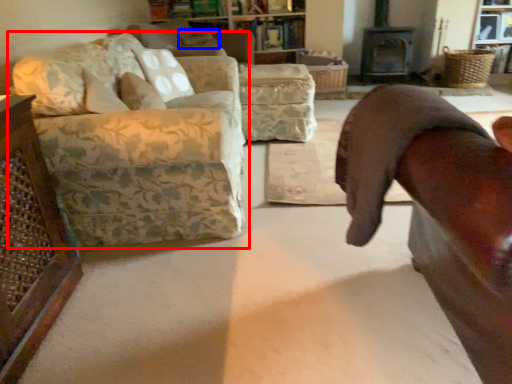
Question: Which point is further to the camera, studio couch (highlighted by a red box) or pillow (highlighted by a blue box)?

Choices:
 (A) studio couch
 (B) pillow

Answer: (B)